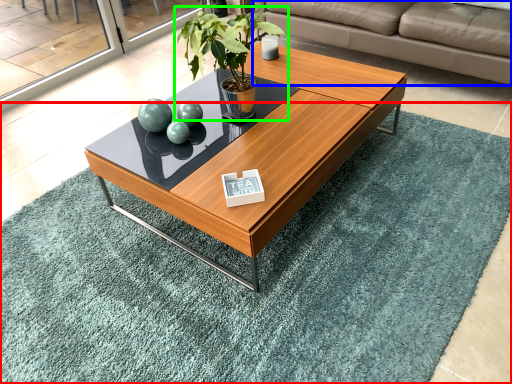
Question: Which object is the closest to the mat (highlighted by a red box)? Choose among these: studio couch (highlighted by a blue box) or houseplant (highlighted by a green box).

Choices:
 (A) studio couch
 (B) houseplant

Answer: (B)